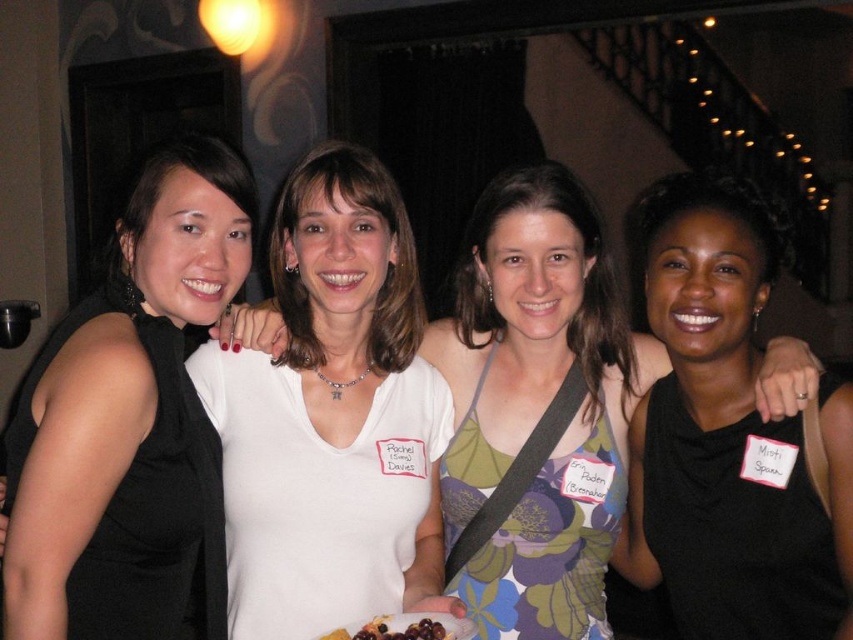
Based on the scene description, which object is larger in size between the white matte shirt at center and the black sleeveless dress at left?

The white matte shirt at center is larger in size compared to the black sleeveless dress at left according to the description.

You are a photographer setting up for a group photo. You need to ensure that the white matte tank top at center and the black satin dress at center are both visible in the frame. Given their sizes, which clothing item might require you to adjust the camera angle to avoid being cropped out?

The white matte tank top at center has a larger width than the black satin dress at center, so it might require adjusting the camera angle to avoid being cropped out.

You are a photographer holding a camera. You want to take a photo of the white matte tank top at center without moving the camera. Can you do it?

The white matte tank top at center and camera are 4.20 feet apart from each other, so yes, you can take a photo of the white matte tank top at center without moving the camera as the distance is sufficient for capturing the image.